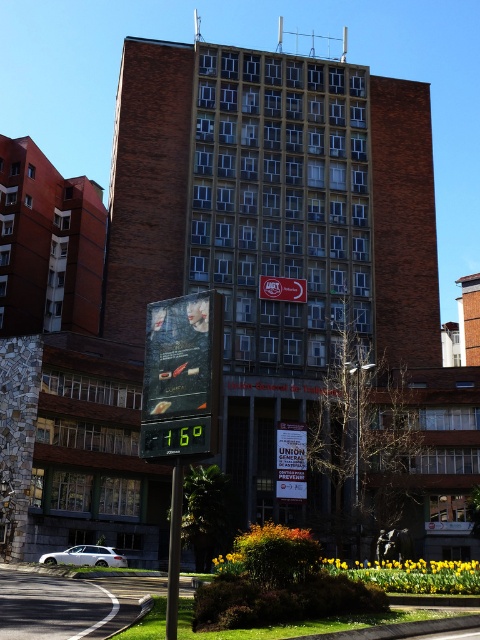
Which is below, green digital display at center or black metal pole at lower center?

black metal pole at lower center is below.

Does green digital display at center have a smaller size compared to black metal pole at lower center?

Actually, green digital display at center might be larger than black metal pole at lower center.

Who is more distant from viewer, [201,381] or [178,461]?

Point [201,381]

Identify the location of green digital display at center. (180, 401).